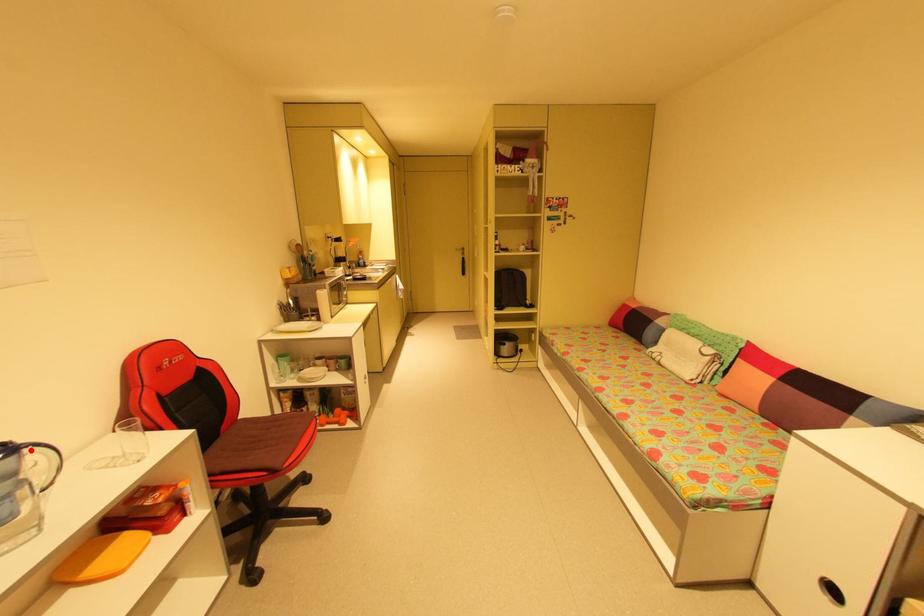
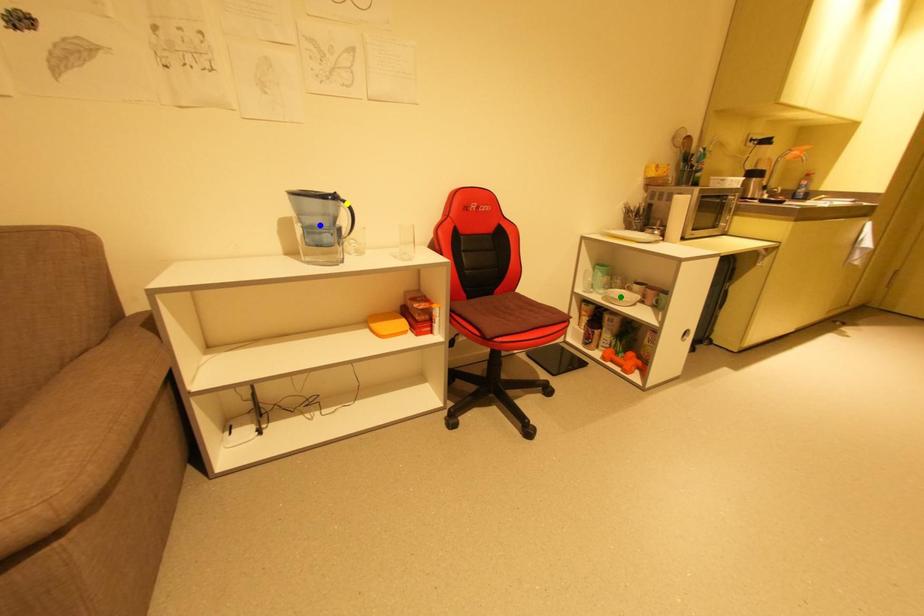
Question: I am providing you with two images of the same scene from different viewpoints. A red point is marked on the first image. You are given multiple points on the second image. Which spot in image 2 lines up with the point in image 1?

Choices:
 (A) green point
 (B) blue point
 (C) yellow point

Answer: (C)